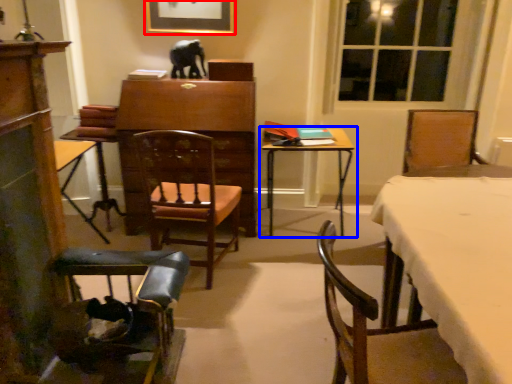
Question: Which object is closer to the camera taking this photo, picture frame (highlighted by a red box) or table (highlighted by a blue box)?

Choices:
 (A) picture frame
 (B) table

Answer: (B)